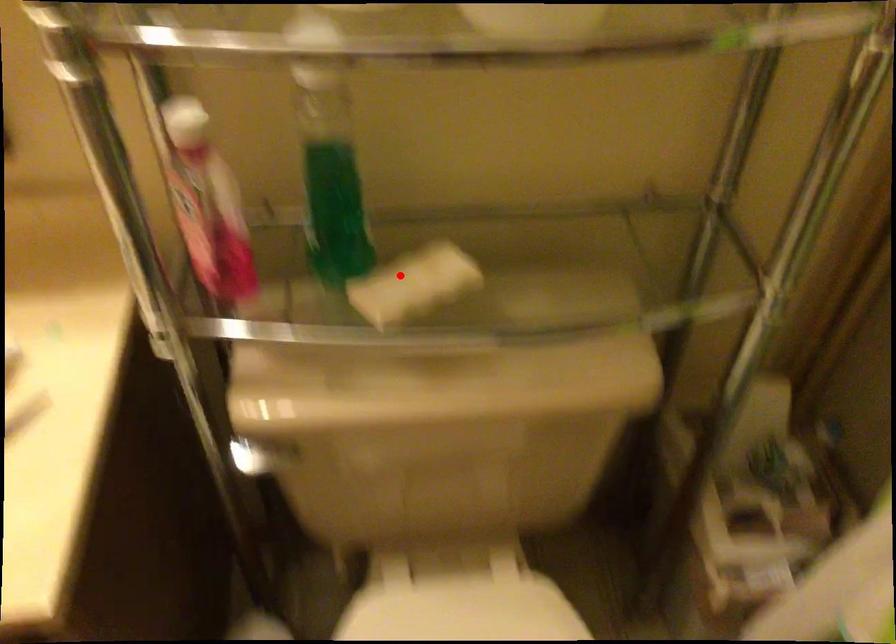
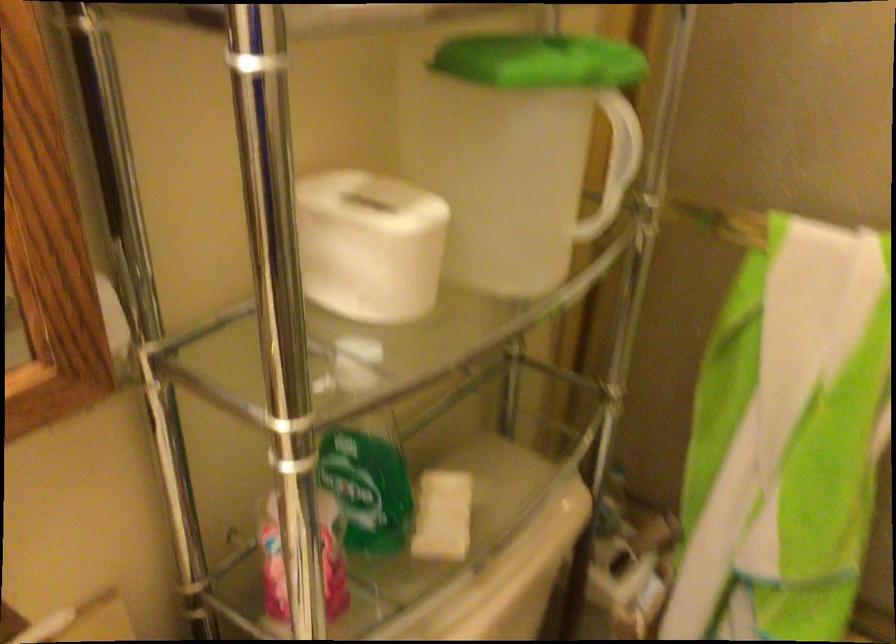
Question: I am providing you with two images of the same scene from different viewpoints. In image1, a red point is highlighted. Considering the same 3D point in image2, which of the following is correct?

Choices:
 (A) It is closer
 (B) It is farther

Answer: (B)